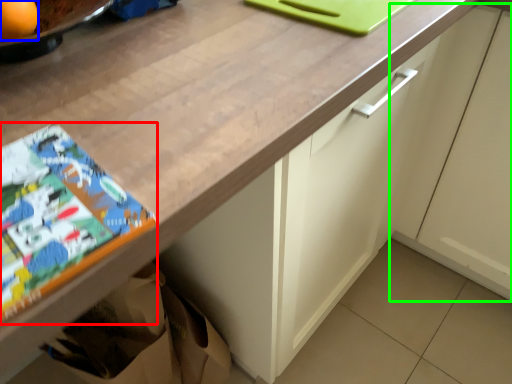
Question: Which object is the farthest from comic book (highlighted by a red box)? Choose among these: orange (highlighted by a blue box) or cabinetry (highlighted by a green box).

Choices:
 (A) orange
 (B) cabinetry

Answer: (B)